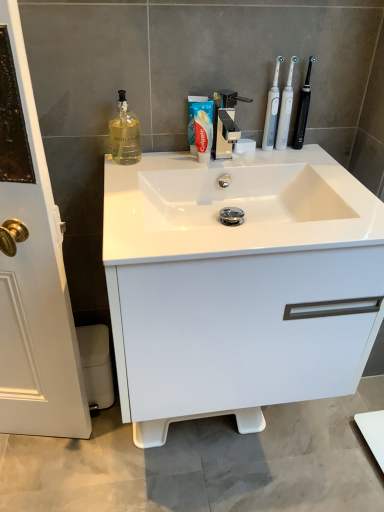
This screenshot has width=384, height=512. I want to click on free location to the left of white plastic toothbrush at upper center, the first toothbrush in the left-to-right sequence, so click(x=205, y=160).